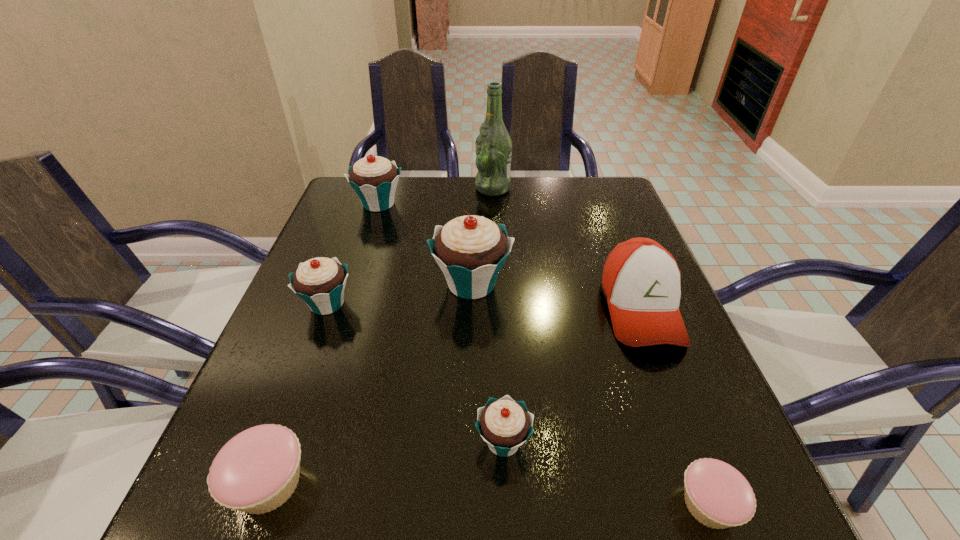
You are a GUI agent. You are given a task and a screenshot of the screen. Output one action in this format:
    pyautogui.click(x=<x>, y=<y>)
    Task: Click on the object situated at the near right corner
    
    Given the screenshot: What is the action you would take?
    pyautogui.click(x=718, y=496)

The height and width of the screenshot is (540, 960). In order to click on free space at the far edge of the desktop in this screenshot , I will do `click(423, 201)`.

Where is `free space at the near edge of the desktop`? Image resolution: width=960 pixels, height=540 pixels. free space at the near edge of the desktop is located at coordinates (460, 520).

Find the location of a particular element. This screenshot has width=960, height=540. vacant position at the left edge of the desktop is located at coordinates (277, 338).

Locate an element on the screen. The width and height of the screenshot is (960, 540). vacant space at the right edge is located at coordinates (634, 374).

The width and height of the screenshot is (960, 540). In the image, there is a desktop. In order to click on blank space at the far right corner in this screenshot , I will do `click(621, 199)`.

At what (x,y) coordinates should I click in order to perform the action: click on free point between the bigger pink cupcake and the third biggest teal cupcake. Please return your answer as a coordinate pair (x, y). Looking at the image, I should click on (298, 394).

At what (x,y) coordinates should I click in order to perform the action: click on unoccupied area between the second biggest teal cupcake and the baseball cap. Please return your answer as a coordinate pair (x, y). This screenshot has height=540, width=960. Looking at the image, I should click on point(510,256).

Identify the location of free space between the farthest teal cupcake and the fourth shortest cupcake. Image resolution: width=960 pixels, height=540 pixels. (353, 254).

Identify the location of vacant area that lies between the smallest teal cupcake and the bigger pink cupcake. (386, 462).